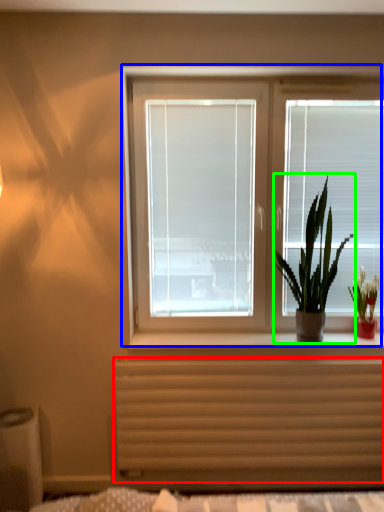
Question: Which object is positioned closest to radiator (highlighted by a red box)? Select from window (highlighted by a blue box) and houseplant (highlighted by a green box).

Choices:
 (A) window
 (B) houseplant

Answer: (B)